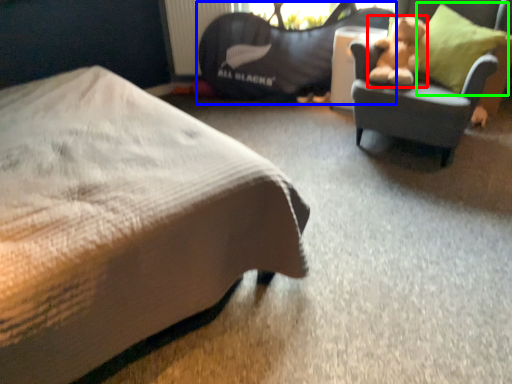
Question: Which is farther away from teddy bear (highlighted by a red box)? bean bag chair (highlighted by a blue box) or throw pillow (highlighted by a green box)?

Choices:
 (A) bean bag chair
 (B) throw pillow

Answer: (A)